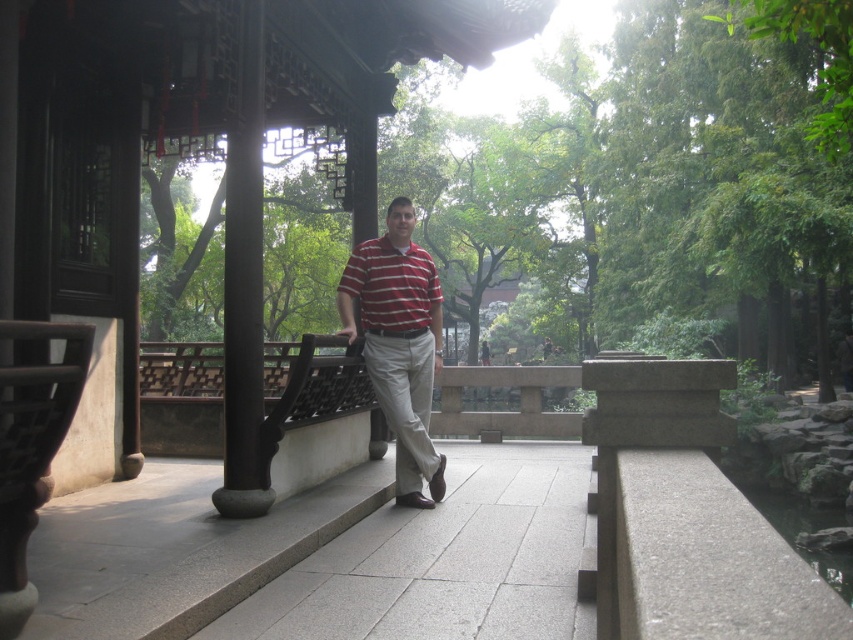
Question: Which of the following is the closest to the observer?

Choices:
 (A) (554, 545)
 (B) (131, 3)
 (C) (430, 268)
 (D) (367, 300)

Answer: (A)

Question: Which object appears closest to the camera in this image?

Choices:
 (A) striped cotton polo shirt at center
 (B) gray stone path at center

Answer: (B)

Question: Which object appears closest to the camera in this image?

Choices:
 (A) matte striped shirt at center
 (B) wooden lattice gazebo at center
 (C) gray stone path at center
 (D) striped cotton polo shirt at center

Answer: (C)

Question: Does wooden lattice gazebo at center appear under striped cotton polo shirt at center?

Choices:
 (A) yes
 (B) no

Answer: (B)

Question: Where is wooden lattice gazebo at center located in relation to matte striped shirt at center in the image?

Choices:
 (A) left
 (B) right

Answer: (A)

Question: Is wooden lattice gazebo at center bigger than gray stone path at center?

Choices:
 (A) yes
 (B) no

Answer: (A)